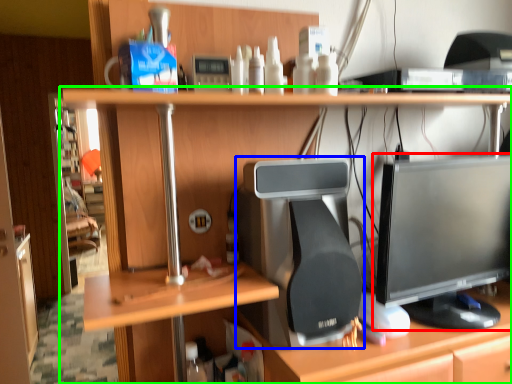
Question: Which object is positioned farthest from computer monitor (highlighted by a red box)? Select from desktop computer (highlighted by a blue box) and desk (highlighted by a green box).

Choices:
 (A) desktop computer
 (B) desk

Answer: (B)